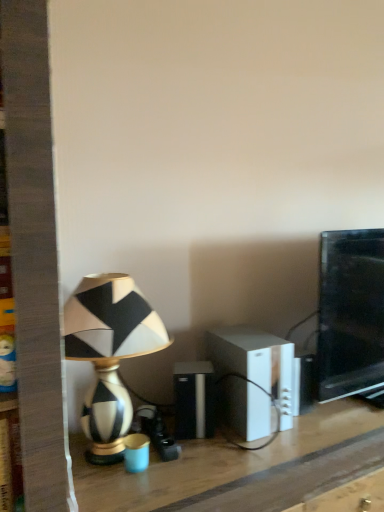
Find the location of `vacant area located to the right-hand side of black and white ceramic lamp at left`. vacant area located to the right-hand side of black and white ceramic lamp at left is located at coordinates [219, 461].